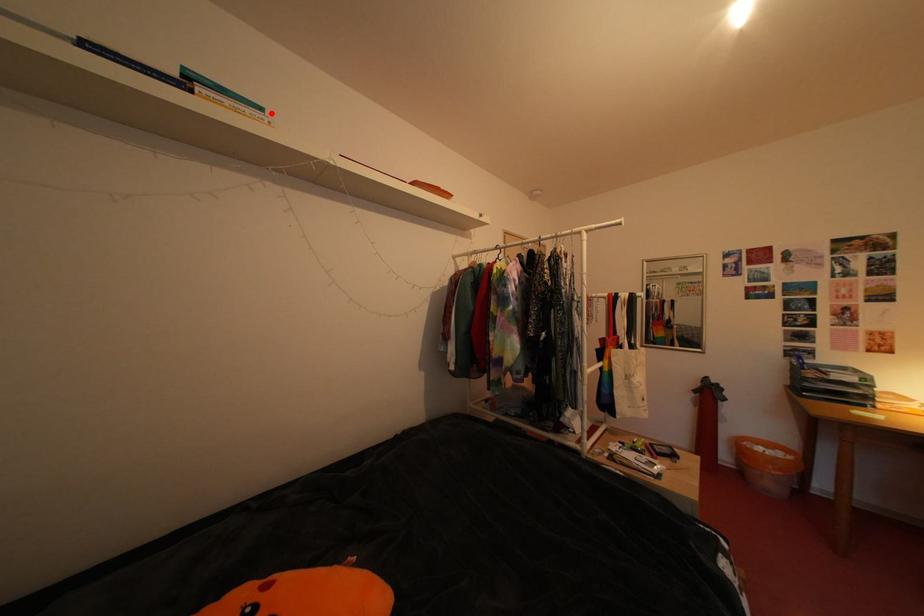
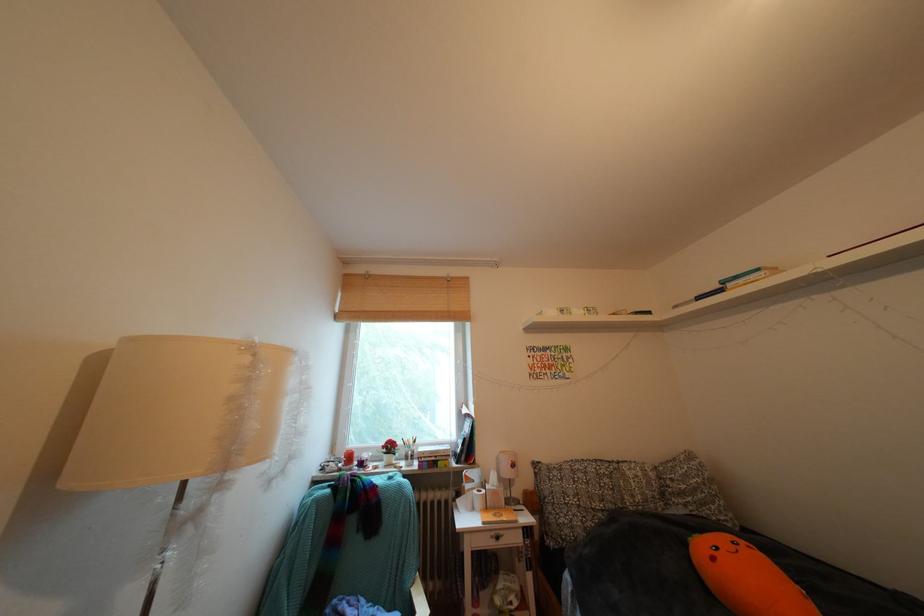
Where in the second image is the point corresponding to the highlighted location from the first image?

(768, 275)